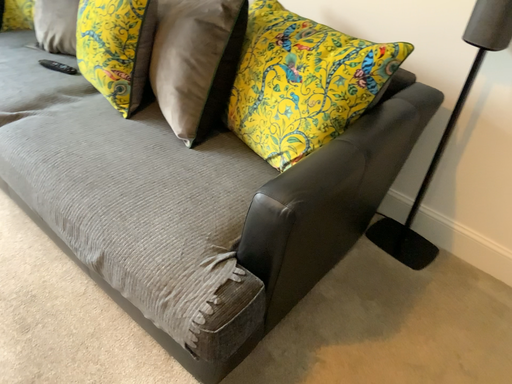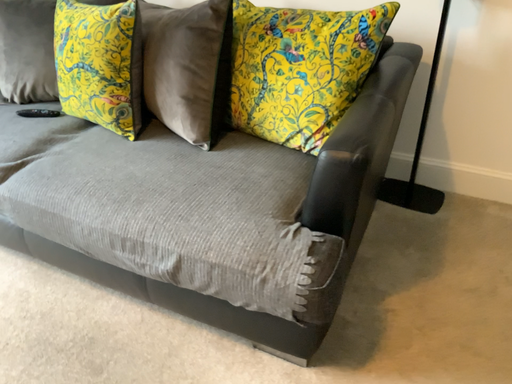
Question: How did the camera likely rotate when shooting the video?

Choices:
 (A) rotated left
 (B) rotated right

Answer: (B)